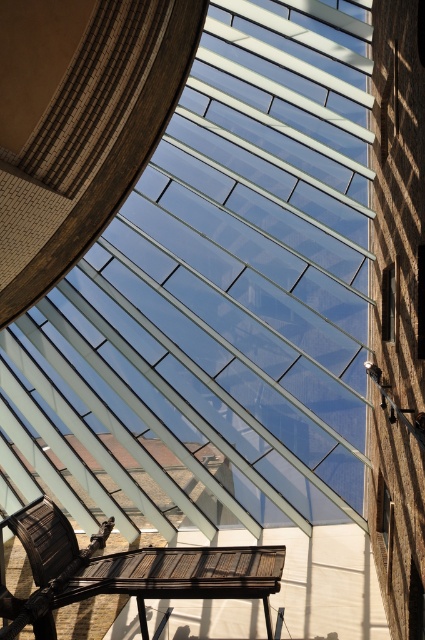
You are standing at the entrance of this modern structure and want to sit down. You see the wooden slats bench at lower center and the brown tile roof at center. Which object is closer to you?

The wooden slats bench at lower center is closer to you because it is positioned below the brown tile roof at center, indicating it is lower and nearer in the structure.

You are planning to install a new lighting fixture that requires a 4 meter clearance between the wooden slats bench at lower center and the brown tile roof at center. Based on the scene, is there enough space for the installation?

The wooden slats bench at lower center is 3.67 meters away from the brown tile roof at center. Since the required clearance is 4 meters, there is insufficient space for the installation.